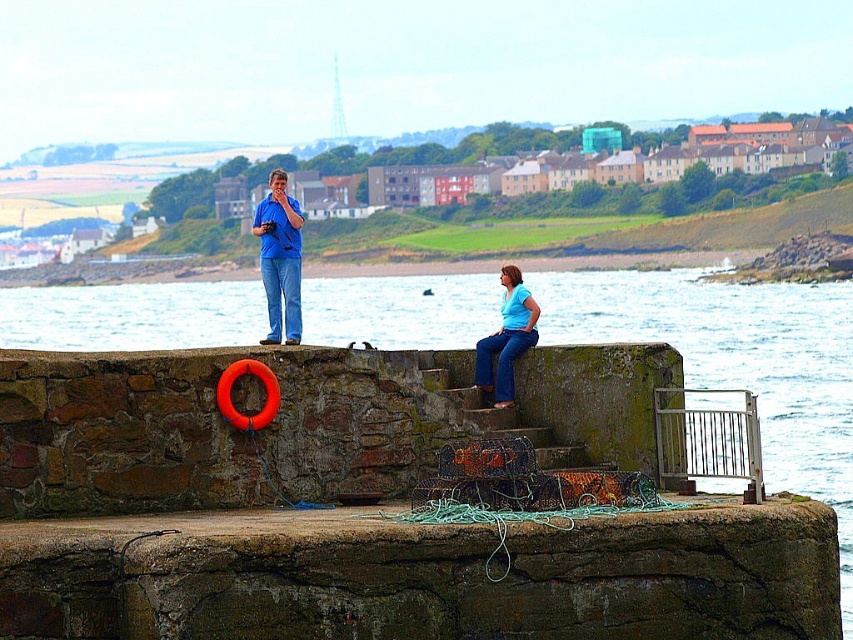
Question: Is blue water at center smaller than blue denim jeans at center?

Choices:
 (A) no
 (B) yes

Answer: (A)

Question: Which point is closer to the camera?

Choices:
 (A) (520, 326)
 (B) (370, 280)

Answer: (A)

Question: Among these objects, which one is nearest to the camera?

Choices:
 (A) blue denim jeans at center
 (B) blue water at center

Answer: (B)

Question: Does blue water at center lie in front of blue denim jeans at center?

Choices:
 (A) no
 (B) yes

Answer: (B)

Question: Is blue water at center closer to camera compared to blue denim jeans at center?

Choices:
 (A) no
 (B) yes

Answer: (B)